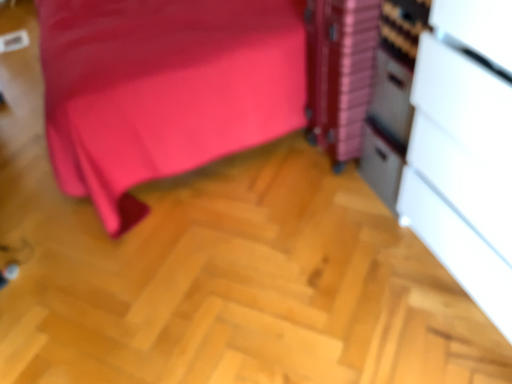
Question: Is white matte/file cabinet at right, which is the 2th file cabinet in back-to-front order, wider or thinner than metallic silver file cabinet at right, which is counted as the 2th file cabinet, starting from the front?

Choices:
 (A) wide
 (B) thin

Answer: (A)

Question: Visually, is white matte/file cabinet at right, the first file cabinet from the front, positioned to the left or to the right of metallic silver file cabinet at right, which is counted as the 2th file cabinet, starting from the front?

Choices:
 (A) right
 (B) left

Answer: (A)

Question: From the image's perspective, is white matte/file cabinet at right, which is the 2th file cabinet in back-to-front order, positioned above or below metallic silver file cabinet at right, which is counted as the 2th file cabinet, starting from the front?

Choices:
 (A) above
 (B) below

Answer: (B)

Question: In the image, is metallic silver file cabinet at right, which is counted as the 2th file cabinet, starting from the front, positioned in front of or behind white matte/file cabinet at right, which is the 2th file cabinet in back-to-front order?

Choices:
 (A) front
 (B) behind

Answer: (B)

Question: From a real-world perspective, is metallic silver file cabinet at right, which is counted as the 2th file cabinet, starting from the front, positioned above or below white matte/file cabinet at right, the first file cabinet from the front?

Choices:
 (A) below
 (B) above

Answer: (A)

Question: From the image's perspective, is metallic silver file cabinet at right, the first file cabinet positioned from the back, above or below white matte/file cabinet at right, the first file cabinet from the front?

Choices:
 (A) below
 (B) above

Answer: (B)

Question: Is point pos(312,8) closer or farther from the camera than point pos(440,195)?

Choices:
 (A) closer
 (B) farther

Answer: (B)